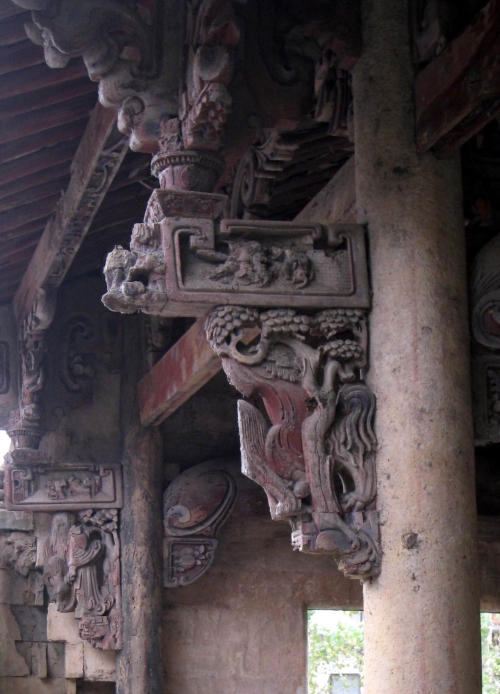
This screenshot has height=694, width=500. Identify the location of window. (341, 648).